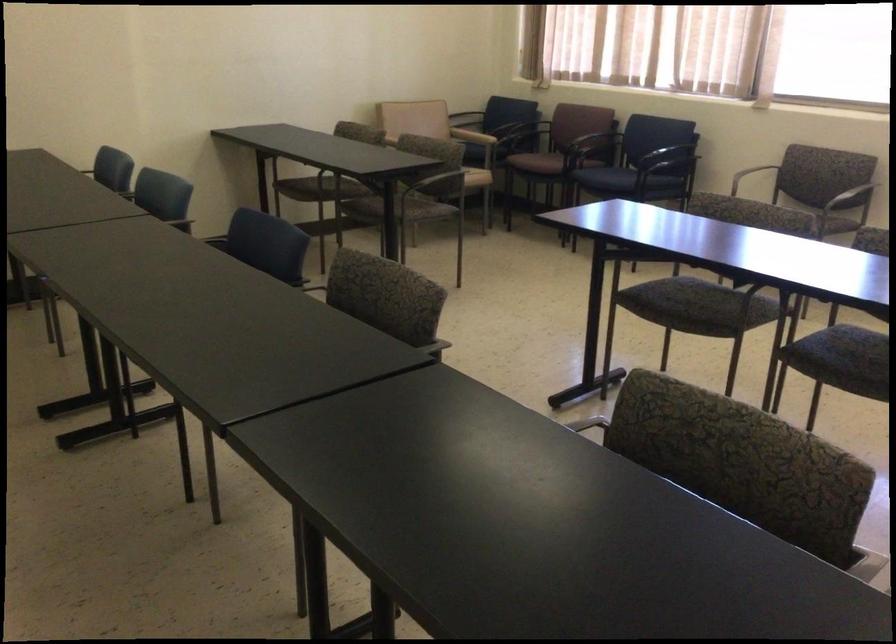
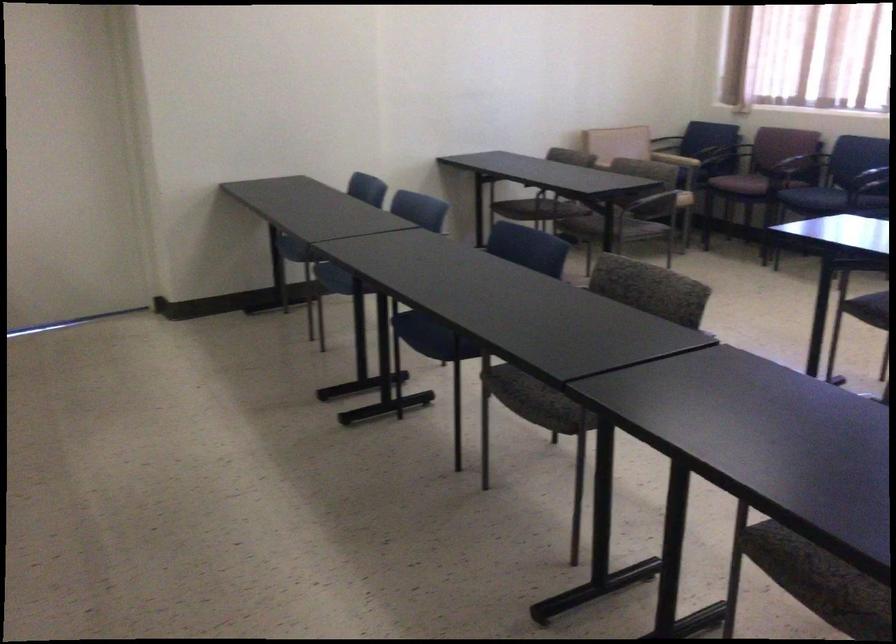
Find the pixel in the second image that matches the point at 632,299 in the first image.

(868, 308)